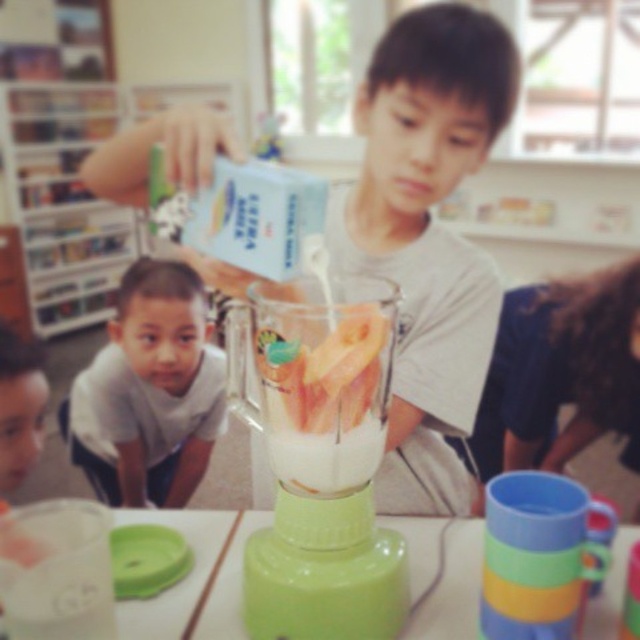
Is orange fleshed fruit at center thinner than white matte milkshake at center?

Incorrect, orange fleshed fruit at center's width is not less than white matte milkshake at center's.

Measure the distance between orange fleshed fruit at center and white matte milkshake at center.

The distance of orange fleshed fruit at center from white matte milkshake at center is 3.83 centimeters.

Between point (291, 420) and point (292, 454), which one is positioned behind?

Positioned behind is point (292, 454).

Where is `orange fleshed fruit at center`? The width and height of the screenshot is (640, 640). orange fleshed fruit at center is located at coordinates pos(328,368).

Looking at this image, can you confirm if green plastic blender at center is shorter than orange fleshed fruit at center?

Incorrect, green plastic blender at center's height does not fall short of orange fleshed fruit at center's.

Who is taller, green plastic blender at center or orange fleshed fruit at center?

Standing taller between the two is green plastic blender at center.

Is point (371, 580) in front of point (320, 378)?

That is False.

Find the location of `green plastic blender at center`. green plastic blender at center is located at coordinates (320, 458).

Based on the photo, measure the distance from clear plastic cup at lower left to orange fleshed fruit at center.

clear plastic cup at lower left and orange fleshed fruit at center are 8.21 inches apart.

Does clear plastic cup at lower left have a greater width compared to orange fleshed fruit at center?

No.

Image resolution: width=640 pixels, height=640 pixels. What are the coordinates of `clear plastic cup at lower left` in the screenshot? It's located at (56, 570).

Find the location of `clear plastic cup at lower left`. clear plastic cup at lower left is located at coordinates (56, 570).